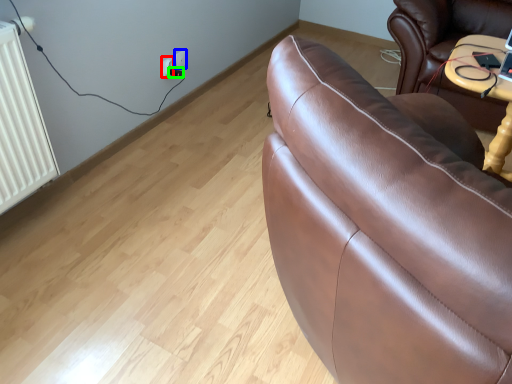
Question: Estimate the real-world distances between objects in this image. Which object is closer to electric outlet (highlighted by a red box), electric outlet (highlighted by a blue box) or plug (highlighted by a green box)?

Choices:
 (A) electric outlet
 (B) plug

Answer: (B)